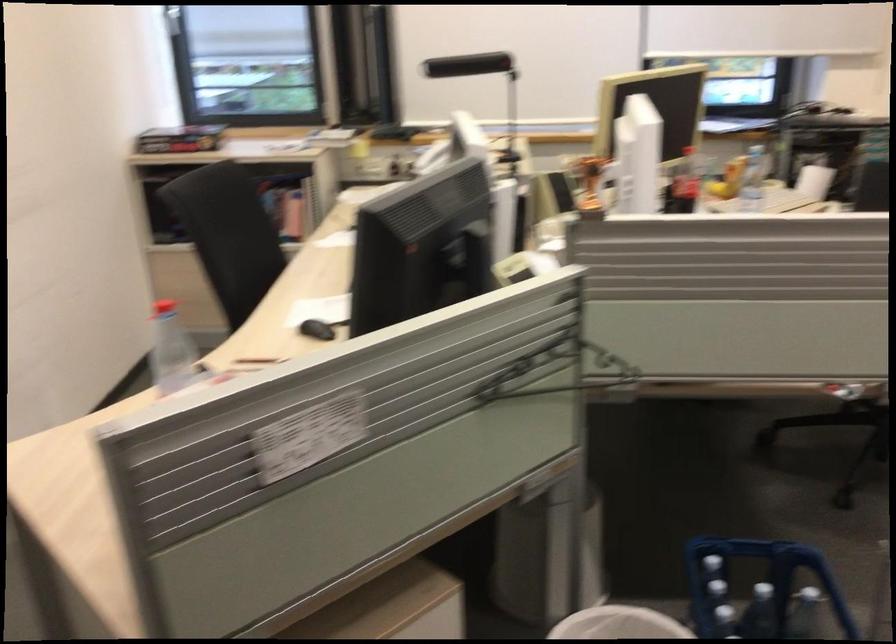
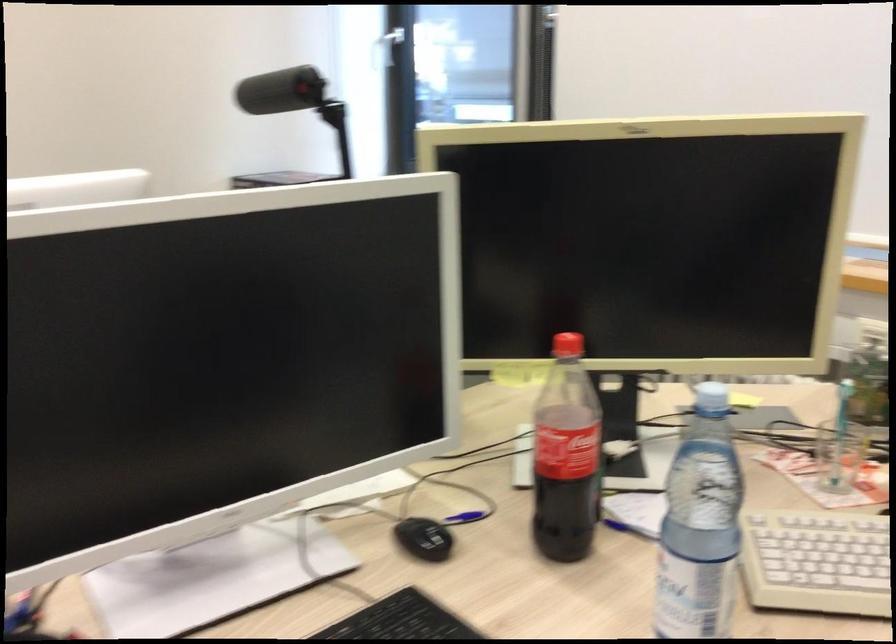
Locate, in the second image, the point that corresponds to (699,184) in the first image.

(839, 456)